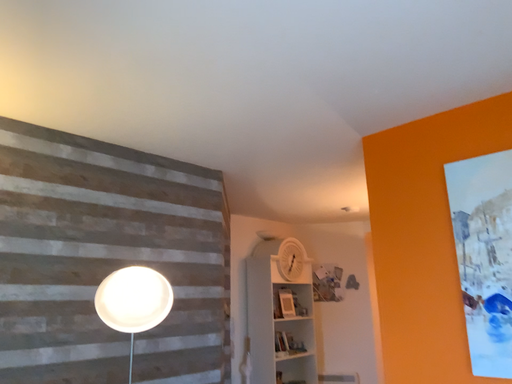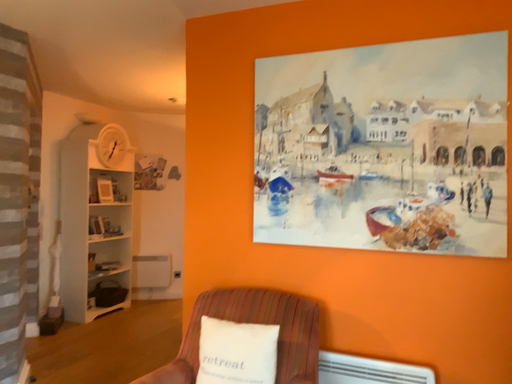
Question: How did the camera likely rotate when shooting the video?

Choices:
 (A) rotated right
 (B) rotated left

Answer: (A)